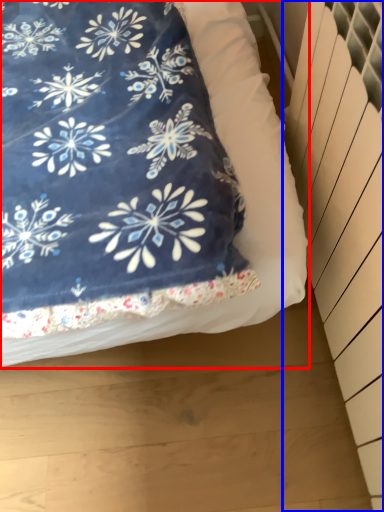
Question: Which of the following is the farthest to the observer, bed (highlighted by a red box) or radiator (highlighted by a blue box)?

Choices:
 (A) bed
 (B) radiator

Answer: (A)